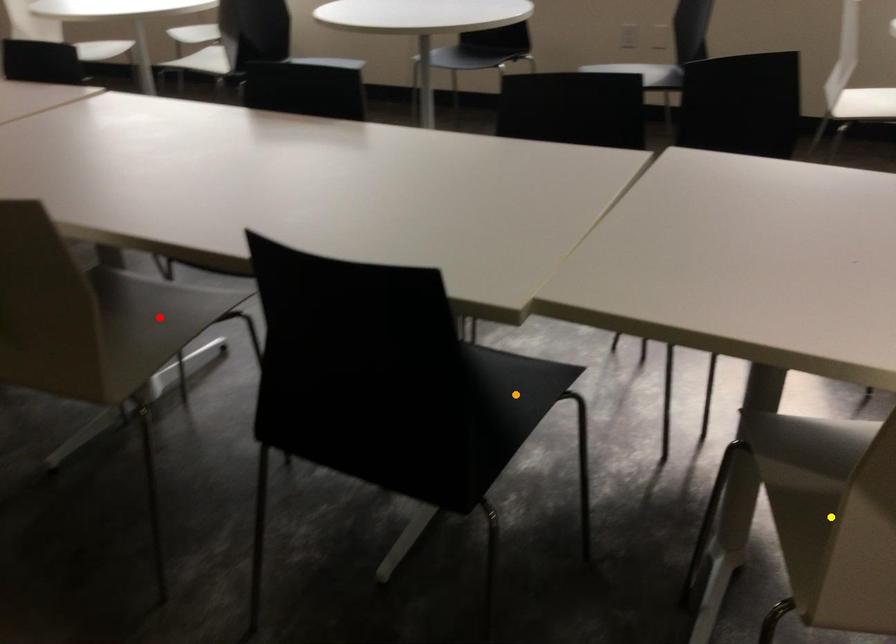
In the scene shown: Order these from farthest to nearest:
red point
yellow point
orange point

orange point → red point → yellow point